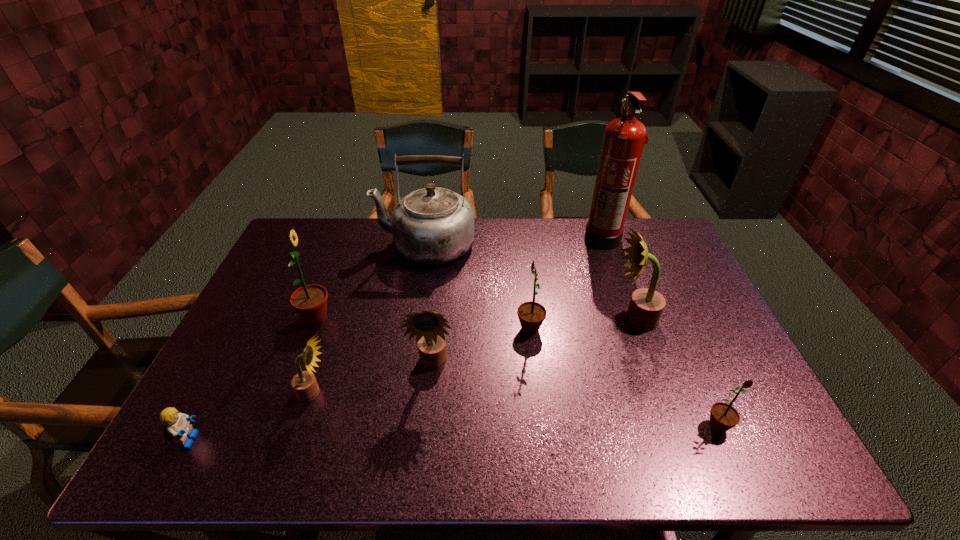
The image size is (960, 540). I want to click on free location located on the face of the rightmost yellow sunflower, so click(484, 320).

Where is `free point located 0.340m on the face of the rightmost yellow sunflower`? The height and width of the screenshot is (540, 960). free point located 0.340m on the face of the rightmost yellow sunflower is located at coordinates (491, 320).

Find the location of a particular element. This screenshot has height=540, width=960. free space located 0.230m on the face of the rightmost yellow sunflower is located at coordinates (530, 320).

Locate an element on the screen. vacant space located on the face of the biggest green sunflower is located at coordinates (369, 318).

Where is `vacant region located 0.100m on the face of the sixth object from left to right`? The image size is (960, 540). vacant region located 0.100m on the face of the sixth object from left to right is located at coordinates (479, 329).

Image resolution: width=960 pixels, height=540 pixels. What are the coordinates of `vacant region located 0.150m on the face of the sixth object from left to right` in the screenshot? It's located at (461, 329).

The width and height of the screenshot is (960, 540). I want to click on free space located on the face of the sixth object from left to right, so click(x=396, y=329).

The image size is (960, 540). In order to click on free space located on the face of the second yellow sunflower from left to right in this screenshot , I will do `click(426, 429)`.

You are a GUI agent. You are given a task and a screenshot of the screen. Output one action in this format:
    pyautogui.click(x=<x>, y=<y>)
    Task: Click on the vacant space situated on the face of the leftmost yellow sunflower
    The width and height of the screenshot is (960, 540).
    Given the screenshot: What is the action you would take?
    [463, 393]

Locate an element on the screen. vacant area located on the front-facing side of the Lego is located at coordinates (277, 440).